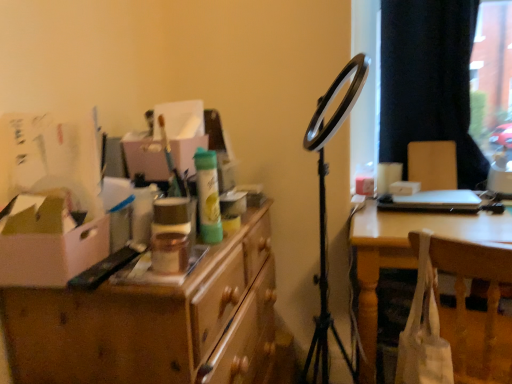
The image size is (512, 384). Find the location of `wooden chair at right`. wooden chair at right is located at coordinates tap(433, 164).

This screenshot has height=384, width=512. Describe the element at coordinates (48, 242) in the screenshot. I see `white cardboard box at left` at that location.

Identify the location of green matte spray can at center, the 1th toiletry positioned from the back. (208, 196).

From the picture: Can you confirm if wooden desk at left is shorter than white fabric bag at lower right?

In fact, wooden desk at left may be taller than white fabric bag at lower right.

In terms of width, does wooden desk at left look wider or thinner when compared to white fabric bag at lower right?

Clearly, wooden desk at left has less width compared to white fabric bag at lower right.

Between point (69, 299) and point (476, 267), which one is positioned behind?

The point (476, 267) is farther from the camera.

From a real-world perspective, does white fabric bag at lower right sit lower than green matte spray can at center, the 1th toiletry positioned from the back?

Correct, in the physical world, white fabric bag at lower right is lower than green matte spray can at center, the 1th toiletry positioned from the back.

How different are the orientations of white fabric bag at lower right and green matte spray can at center, the 1th toiletry positioned from the back, in degrees?

The facing directions of white fabric bag at lower right and green matte spray can at center, the 1th toiletry positioned from the back, are 78.7 degrees apart.

Which is in front, point (471, 261) or point (217, 174)?

The point (471, 261) is in front.

In the scene shown: Is white fabric bag at lower right facing away from green matte spray can at center, the 2th toiletry from the front?

No, white fabric bag at lower right is not facing the opposite direction of green matte spray can at center, the 2th toiletry from the front.

Would you say wooden chair at right is part of white cardboard box at left's contents?

Actually, wooden chair at right is outside white cardboard box at left.

Between white cardboard box at left and wooden chair at right, which one has smaller size?

With smaller size is white cardboard box at left.

Does point (13, 265) lie in front of point (453, 148)?

Yes, it is in front of point (453, 148).

Is white cardboard box at left turned away from wooden chair at right?

white cardboard box at left does not have its back to wooden chair at right.

Would you say black fabric curtain at upper right is a long distance from wooden desk at left?

black fabric curtain at upper right is positioned a significant distance from wooden desk at left.

Locate an element on the screen. Image resolution: width=512 pixels, height=384 pixels. curtain above the wooden desk at left (from the image's perspective) is located at coordinates (428, 81).

Is black fabric curtain at upper right positioned with its back to wooden desk at left?

That's not correct — black fabric curtain at upper right is not looking away from wooden desk at left.

Does metallic gold jar at center, which is the 2th toiletry in back-to-front order, have a smaller size compared to black fabric curtain at upper right?

Yes, metallic gold jar at center, which is the 2th toiletry in back-to-front order, is smaller than black fabric curtain at upper right.

Measure the distance between metallic gold jar at center, which is the 2th toiletry in back-to-front order, and black fabric curtain at upper right.

The distance of metallic gold jar at center, which is the 2th toiletry in back-to-front order, from black fabric curtain at upper right is 1.50 meters.

What's the angular difference between metallic gold jar at center, which is the 2th toiletry in back-to-front order, and black fabric curtain at upper right's facing directions?

93.8 degrees separate the facing orientations of metallic gold jar at center, which is the 2th toiletry in back-to-front order, and black fabric curtain at upper right.

From the picture: Which object is more forward, metallic gold jar at center, which is the 2th toiletry in back-to-front order, or black fabric curtain at upper right?

metallic gold jar at center, which is the 2th toiletry in back-to-front order, is closer to the camera.

Is black fabric curtain at upper right surrounded by white cardboard box at left?

That's incorrect, black fabric curtain at upper right is not inside white cardboard box at left.

Is white cardboard box at left positioned in front of black fabric curtain at upper right?

Yes.

In the scene shown: From the image's perspective, is white cardboard box at left under black fabric curtain at upper right?

Yes.

Which is more distant, (91, 231) or (187, 261)?

Point (91, 231)

Are white cardboard box at left and metallic gold jar at center, acting as the first toiletry starting from the front, located far from each other?

white cardboard box at left is near metallic gold jar at center, acting as the first toiletry starting from the front, not far away.

Which of these two, white cardboard box at left or metallic gold jar at center, acting as the first toiletry starting from the front, stands taller?

Standing taller between the two is white cardboard box at left.

Find the location of `chair that is above the wooden desk at left (from a real-world perspective)`. chair that is above the wooden desk at left (from a real-world perspective) is located at coordinates (476, 311).

What are the coordinates of `chair lying below the green matte spray can at center, the 1th toiletry positioned from the back (from the image's perspective)` in the screenshot? It's located at (476, 311).

Based on their spatial positions, is green matte spray can at center, the 1th toiletry positioned from the back, or white fabric bag at lower right further from wooden desk at left?

Among the two, white fabric bag at lower right is located further to wooden desk at left.

Estimate the real-world distances between objects in this image. Which object is further from white fabric bag at lower right, wooden desk at left or green matte spray can at center, the 2th toiletry from the front?

green matte spray can at center, the 2th toiletry from the front, is positioned further to the anchor white fabric bag at lower right.

When comparing their distances from wooden desk at left, does black fabric curtain at upper right or wooden chair at right seem further?

The object further to wooden desk at left is black fabric curtain at upper right.

Considering their positions, is green matte spray can at center, the 1th toiletry positioned from the back, positioned further to black fabric curtain at upper right than wooden desk at left?

green matte spray can at center, the 1th toiletry positioned from the back, lies further to black fabric curtain at upper right than the other object.

When comparing their distances from white fabric bag at lower right, does white cardboard box at left or black fabric curtain at upper right seem further?

white cardboard box at left.

Considering their positions, is black fabric curtain at upper right positioned closer to white cardboard box at left than green matte spray can at center, the 1th toiletry positioned from the back?

The object closer to white cardboard box at left is green matte spray can at center, the 1th toiletry positioned from the back.

When comparing their distances from metallic gold jar at center, which is the 2th toiletry in back-to-front order, does green matte spray can at center, the 2th toiletry from the front, or black fabric curtain at upper right seem further?

black fabric curtain at upper right lies further to metallic gold jar at center, which is the 2th toiletry in back-to-front order, than the other object.

Considering their positions, is white fabric bag at lower right positioned further to white cardboard box at left than black fabric curtain at upper right?

black fabric curtain at upper right is positioned further to the anchor white cardboard box at left.

This screenshot has height=384, width=512. What are the coordinates of `toiletry between white fabric bag at lower right and wooden chair at right from front to back` in the screenshot? It's located at (208, 196).

The height and width of the screenshot is (384, 512). What are the coordinates of `toiletry between green matte spray can at center, the 2th toiletry from the front, and wooden desk at left from top to bottom` in the screenshot? It's located at (169, 253).

Image resolution: width=512 pixels, height=384 pixels. I want to click on chair between green matte spray can at center, the 2th toiletry from the front, and black fabric curtain at upper right from left to right, so click(x=476, y=311).

Identify the location of desk located between white cardboard box at left and wooden chair at right in the left-right direction. This screenshot has width=512, height=384. (153, 321).